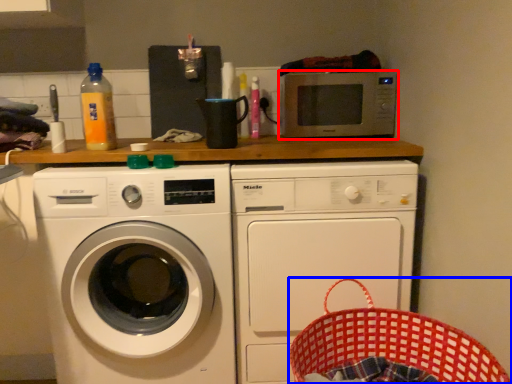
Question: Which point is further to the camera, microwave oven (highlighted by a red box) or basket (highlighted by a blue box)?

Choices:
 (A) microwave oven
 (B) basket

Answer: (A)